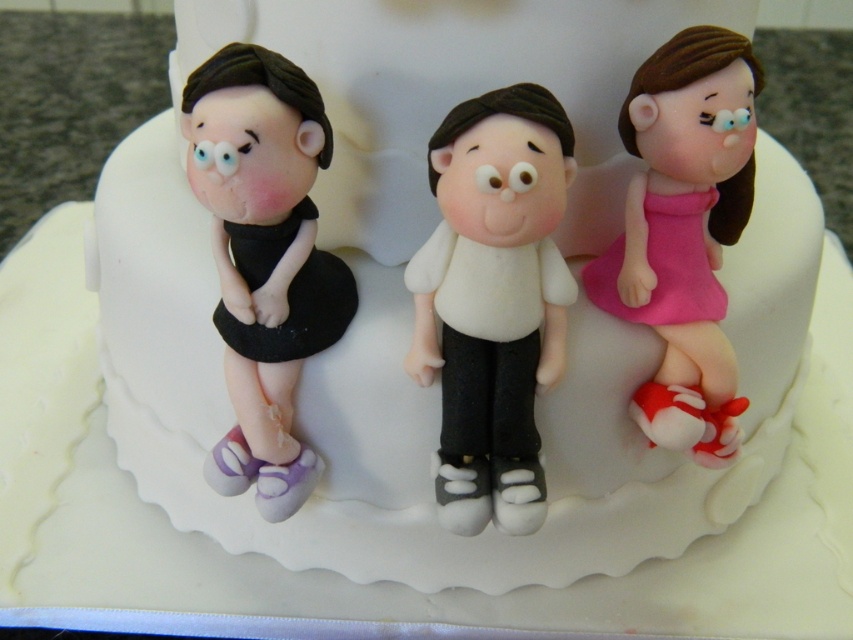
Between white matte figure at center and matte black dress at left, which one is positioned higher?

Positioned higher is matte black dress at left.

Is white matte figure at center bigger than matte black dress at left?

No, white matte figure at center is not bigger than matte black dress at left.

Between point (537, 381) and point (253, 237), which one is positioned in front?

Point (253, 237) is in front.

Find the location of `white matte figure at center`. white matte figure at center is located at coordinates (492, 300).

Can you confirm if matte black dress at left is smaller than pink matte dress at right?

No.

Which of these two, matte black dress at left or pink matte dress at right, stands taller?

With more height is matte black dress at left.

Does point (219, 308) come closer to viewer compared to point (630, 237)?

No.

Find the location of `matte black dress at left`. matte black dress at left is located at coordinates (264, 259).

Between white matte figure at center and pink matte dress at right, which one has more height?

Standing taller between the two is pink matte dress at right.

Is point (544, 371) closer to camera compared to point (689, 372)?

Yes, it is.

Who is more forward, (460, 284) or (665, 353)?

Point (460, 284) is more forward.

Locate an element on the screen. This screenshot has height=640, width=853. white matte figure at center is located at coordinates (492, 300).